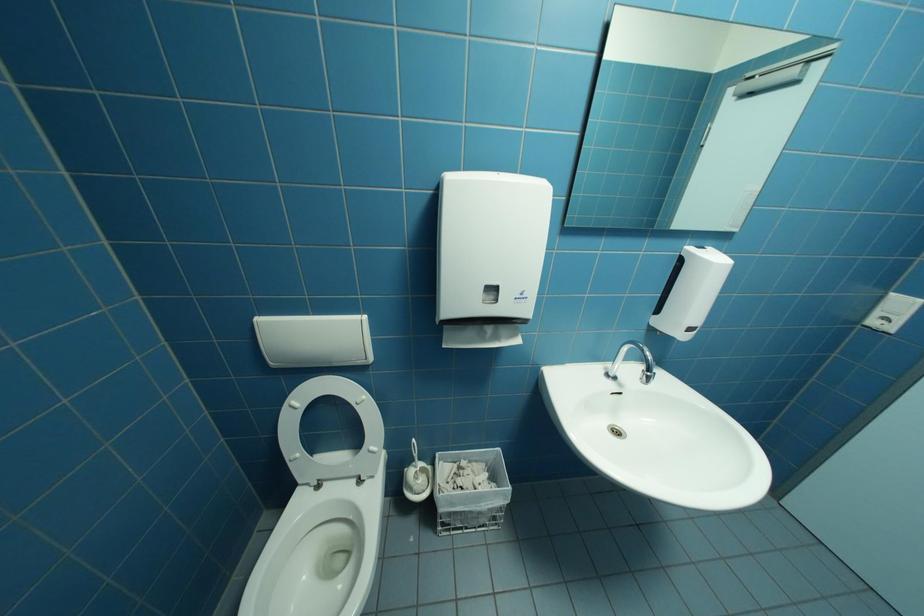
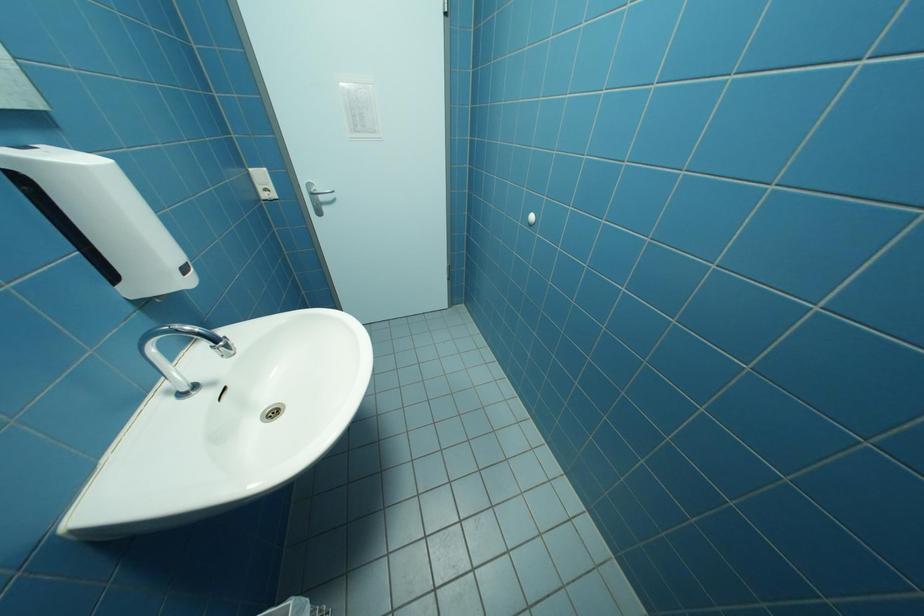
Consider the image. The images are taken continuously from a first-person perspective. In which direction is your viewpoint rotating?

The camera rotated toward right-down.